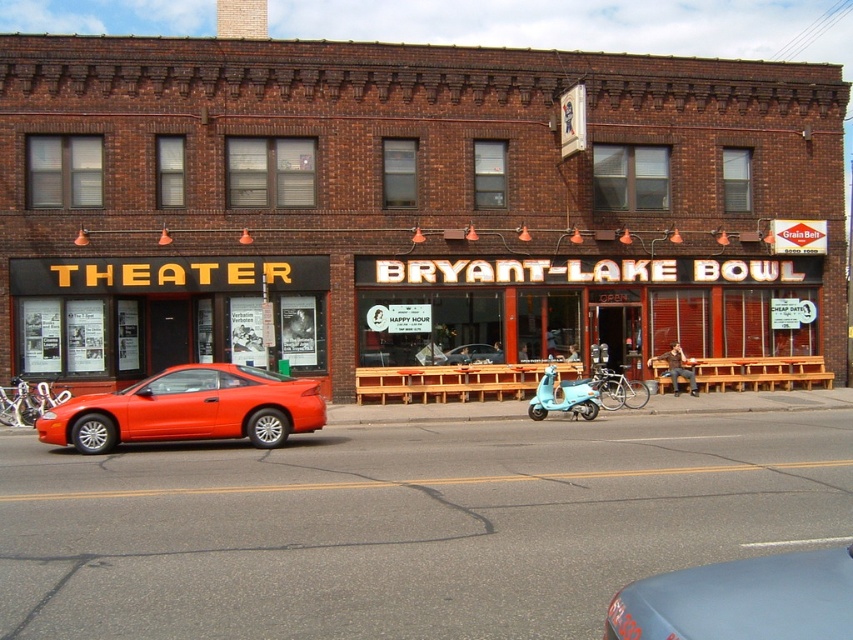
Based on the photo, you are a delivery person who needs to park your shiny orange car at left as close as possible to the brick theater at center without blocking the entrance. Given their height difference, can you park the car under the theater if it has a low clearance? Explain why.

The brick theater at center is much taller than the shiny orange car at left. Since the theater is significantly taller, it likely has a higher clearance or overhang above the parking area. However, if the car has a low clearance, parking under the theater might not be possible due to the theater being much taller, which could mean there are structural elements like awnings or low hanging signs that the car might hit. Therefore, the car should avoid parking under the theater to prevent damage.

Consider the image. You are a delivery person who needs to park your vehicle between the shiny orange car at left and the light blue matte scooter at center. The parking spot you want is exactly 6 meters wide. Can your vehicle fit in the space?

The distance between the shiny orange car at left and the light blue matte scooter at center is 6.44 meters. Since the parking spot is 6 meters wide, your vehicle can fit in the space as there is enough room.

You are a pedestrian standing on the sidewalk in front of the theater and bowling alley. You see a matte blue car at lower center and a shiny red car at center. Which car is positioned lower in the image?

The matte blue car at lower center is positioned lower than the shiny red car at center.